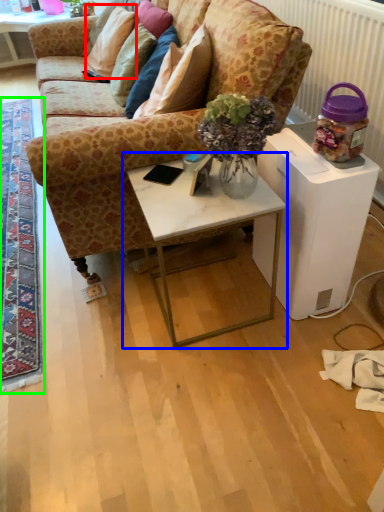
Question: Which object is the farthest from pillow (highlighted by a red box)? Choose among these: table (highlighted by a blue box) or mat (highlighted by a green box).

Choices:
 (A) table
 (B) mat

Answer: (A)